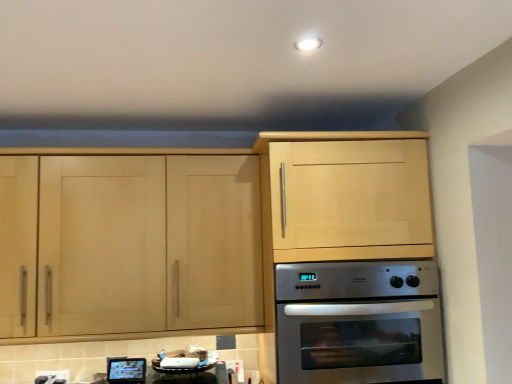
Question: Is metallic silver tv at lower left far from stainless steel oven at lower center?

Choices:
 (A) no
 (B) yes

Answer: (A)

Question: Does metallic silver tv at lower left have a smaller size compared to stainless steel oven at lower center?

Choices:
 (A) no
 (B) yes

Answer: (B)

Question: Considering the relative sizes of metallic silver tv at lower left and stainless steel oven at lower center in the image provided, is metallic silver tv at lower left taller than stainless steel oven at lower center?

Choices:
 (A) no
 (B) yes

Answer: (A)

Question: Is metallic silver tv at lower left positioned beyond the bounds of stainless steel oven at lower center?

Choices:
 (A) yes
 (B) no

Answer: (A)

Question: Is metallic silver tv at lower left in contact with stainless steel oven at lower center?

Choices:
 (A) no
 (B) yes

Answer: (A)

Question: From the image's perspective, is stainless steel oven at lower center located above or below light wood cabinet at left?

Choices:
 (A) above
 (B) below

Answer: (B)

Question: Would you say stainless steel oven at lower center is inside or outside light wood cabinet at left?

Choices:
 (A) outside
 (B) inside

Answer: (A)

Question: From a real-world perspective, is stainless steel oven at lower center positioned above or below light wood cabinet at left?

Choices:
 (A) below
 (B) above

Answer: (A)

Question: Considering the relative positions of stainless steel oven at lower center and light wood cabinet at left in the image provided, is stainless steel oven at lower center to the left or to the right of light wood cabinet at left?

Choices:
 (A) left
 (B) right

Answer: (B)

Question: Considering the positions of point (100, 231) and point (53, 372), is point (100, 231) closer or farther from the camera than point (53, 372)?

Choices:
 (A) closer
 (B) farther

Answer: (A)

Question: Visually, is light wood cabinet at left positioned to the left or to the right of white plastic electric outlet at lower left?

Choices:
 (A) left
 (B) right

Answer: (B)

Question: Is light wood cabinet at left in front of or behind white plastic electric outlet at lower left in the image?

Choices:
 (A) behind
 (B) front

Answer: (B)

Question: From their relative heights in the image, would you say light wood cabinet at left is taller or shorter than white plastic electric outlet at lower left?

Choices:
 (A) short
 (B) tall

Answer: (B)

Question: In the image, is metallic silver tv at lower left positioned in front of or behind light wood cabinet at left?

Choices:
 (A) front
 (B) behind

Answer: (B)

Question: Is metallic silver tv at lower left inside or outside of light wood cabinet at left?

Choices:
 (A) outside
 (B) inside

Answer: (A)